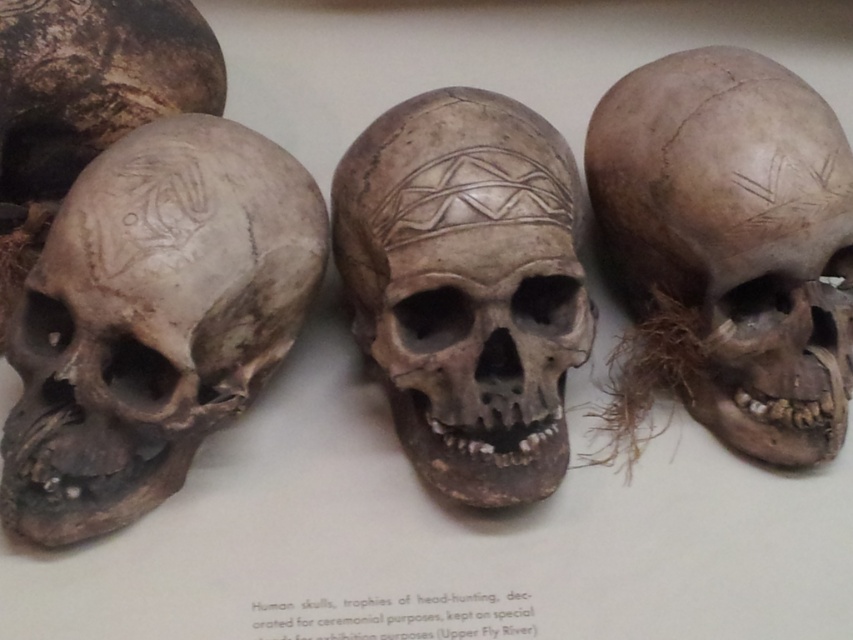
Question: Which of the following is the closest to the observer?

Choices:
 (A) (85, 314)
 (B) (764, 321)
 (C) (10, 220)

Answer: (A)

Question: Which point is farther to the camera?

Choices:
 (A) (157, 170)
 (B) (469, 332)
 (C) (12, 157)

Answer: (C)

Question: Is brown textured skull at center smaller than brown textured skull at right?

Choices:
 (A) yes
 (B) no

Answer: (A)

Question: Which point is farther from the camera taking this photo?

Choices:
 (A) (554, 424)
 (B) (769, 348)

Answer: (B)

Question: Is gray matte skull at left to the left of brown textured skull at center from the viewer's perspective?

Choices:
 (A) no
 (B) yes

Answer: (B)

Question: Is gray matte skull at left positioned before brown textured skull at right?

Choices:
 (A) no
 (B) yes

Answer: (B)